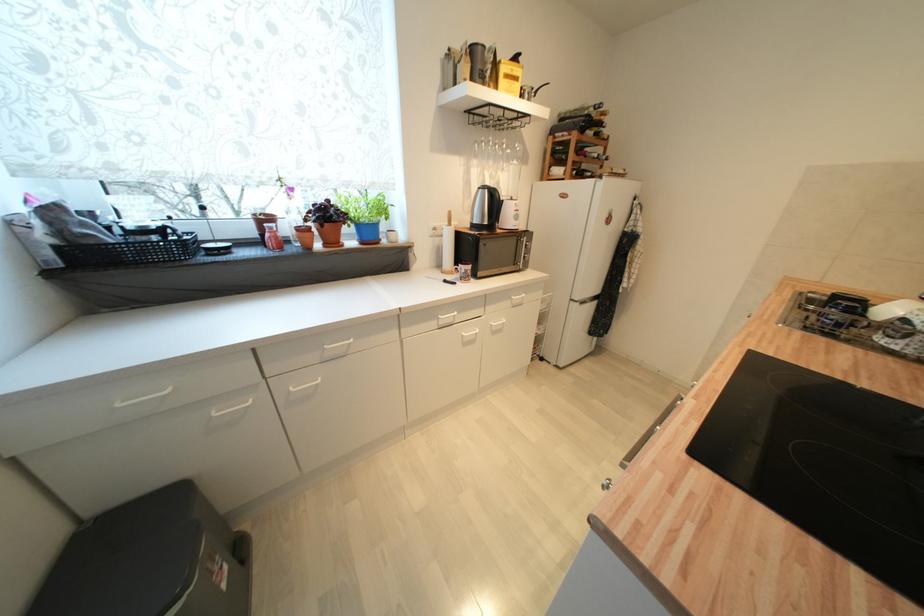
Image resolution: width=924 pixels, height=616 pixels. I want to click on silver electric kettle, so click(x=484, y=208).